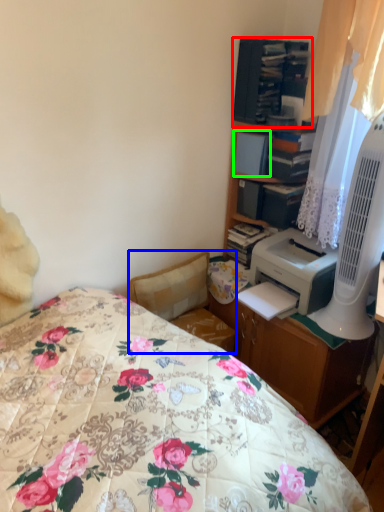
Question: Based on their relative distances, which object is nearer to shelf (highlighted by a red box)? Choose from swivel chair (highlighted by a blue box) and book (highlighted by a green box).

Choices:
 (A) swivel chair
 (B) book

Answer: (B)